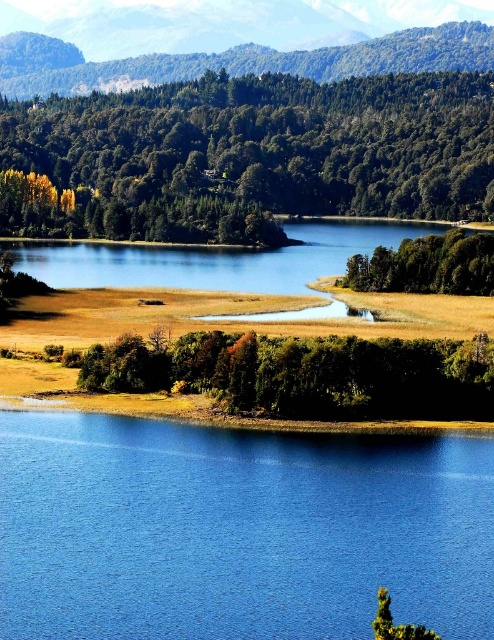
The width and height of the screenshot is (494, 640). What do you see at coordinates (254, 152) in the screenshot? I see `green matte trees at upper center` at bounding box center [254, 152].

Who is positioned more to the right, green matte trees at upper center or green forested mountain at upper center?

green matte trees at upper center is more to the right.

The width and height of the screenshot is (494, 640). I want to click on green matte trees at upper center, so click(254, 152).

Can you confirm if green forested mountain at upper center is positioned below green matte tree at center-right?

Incorrect, green forested mountain at upper center is not positioned below green matte tree at center-right.

Measure the distance between point (115, 6) and camera.

Point (115, 6) and camera are 695.25 meters apart from each other.

In order to click on green forested mountain at upper center in this screenshot , I will do `click(235, 58)`.

Which is below, blue smooth water at lower center or green matte tree at center-right?

blue smooth water at lower center is lower down.

Which of these two, blue smooth water at lower center or green matte tree at center-right, stands taller?

green matte tree at center-right is taller.

Is point (232, 484) closer to viewer compared to point (492, 282)?

Yes, it is in front of point (492, 282).

Where is `blue smooth water at lower center`? blue smooth water at lower center is located at coordinates (238, 531).